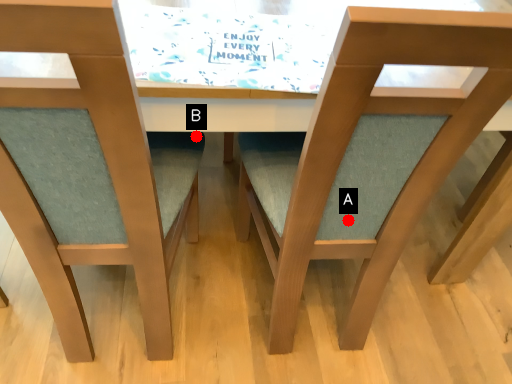
Question: Two points are circled on the image, labeled by A and B beside each circle. Which point is farther to the camera?

Choices:
 (A) A is further
 (B) B is further

Answer: (B)